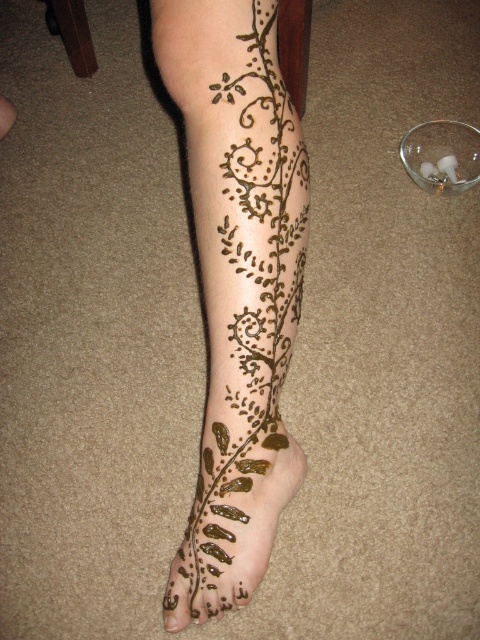
Who is more forward, (283,90) or (266,467)?

Point (283,90)

Measure the distance between brown henna tattoo at lower center and camera.

brown henna tattoo at lower center and camera are 22.92 inches apart from each other.

Identify the location of brown henna tattoo at lower center. Image resolution: width=480 pixels, height=640 pixels. (237, 285).